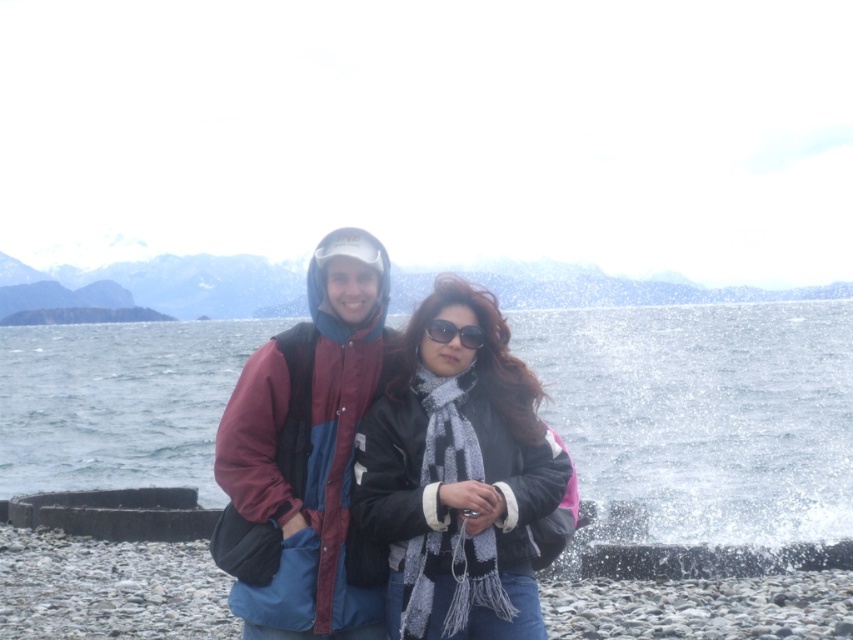
Based on the scene description, where is the clear water at center located in terms of coordinates?

The clear water at center is located at coordinates point (705, 413).

You are a photographer trying to capture a landscape photo of the distant mountains. You are standing at the center of the beach. The black matte jacket at center is blocking your view. Can you move to the left or right to avoid it?

The black matte jacket at center is located at point 0.750 on the x axis and 0.543 on the y axis. Since you are at the center, moving either left or right along the x axis would help you avoid the jacket. Moving left would take you to x < 0.750 and moving right to x > 0.750. Choose whichever direction offers a clearer view of the mountains.

You are a photographer trying to capture the two people in the scene. You notice the black matte jacket at center and the black plastic sunglasses at center. Which object is positioned to the right of the other?

The black matte jacket at center is to the right of the black plastic sunglasses at center.